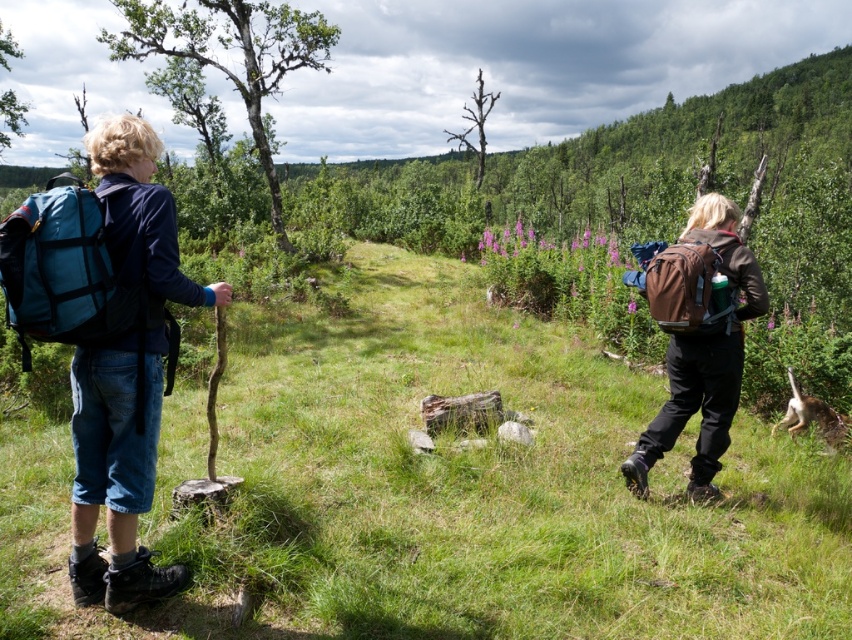
Question: Is brown fabric backpack at right positioned behind brown canvas backpack at right?

Choices:
 (A) no
 (B) yes

Answer: (B)

Question: Does green grassy at center have a greater width compared to brown canvas backpack at right?

Choices:
 (A) yes
 (B) no

Answer: (A)

Question: Which point is farther from the camera taking this photo?

Choices:
 (A) (44, 211)
 (B) (695, 358)

Answer: (B)

Question: Which of the following is the closest to the observer?

Choices:
 (A) (344, 636)
 (B) (701, 465)
 (C) (661, 257)

Answer: (A)

Question: Which object is farther from the camera taking this photo?

Choices:
 (A) green grassy at center
 (B) brown canvas backpack at right
 (C) teal fabric backpack at left
 (D) brown fabric backpack at right

Answer: (D)

Question: Can you confirm if green grassy at center is bigger than brown fabric backpack at right?

Choices:
 (A) no
 (B) yes

Answer: (B)